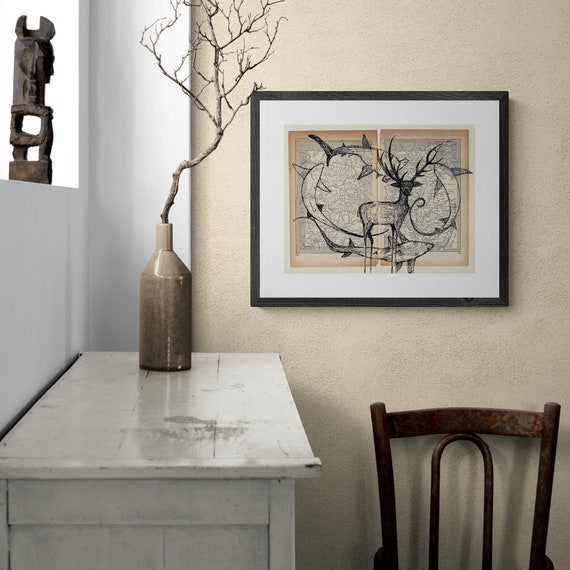
This screenshot has width=570, height=570. I want to click on 1 white wall, so click(52, 320).